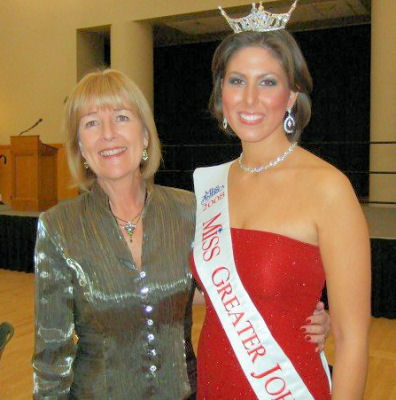
The width and height of the screenshot is (396, 400). I want to click on chair, so click(x=8, y=333).